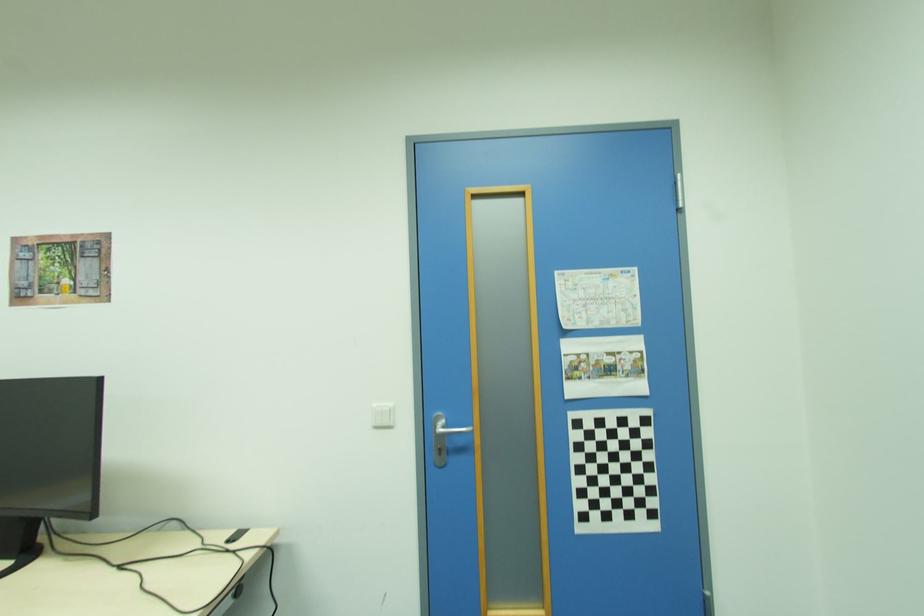
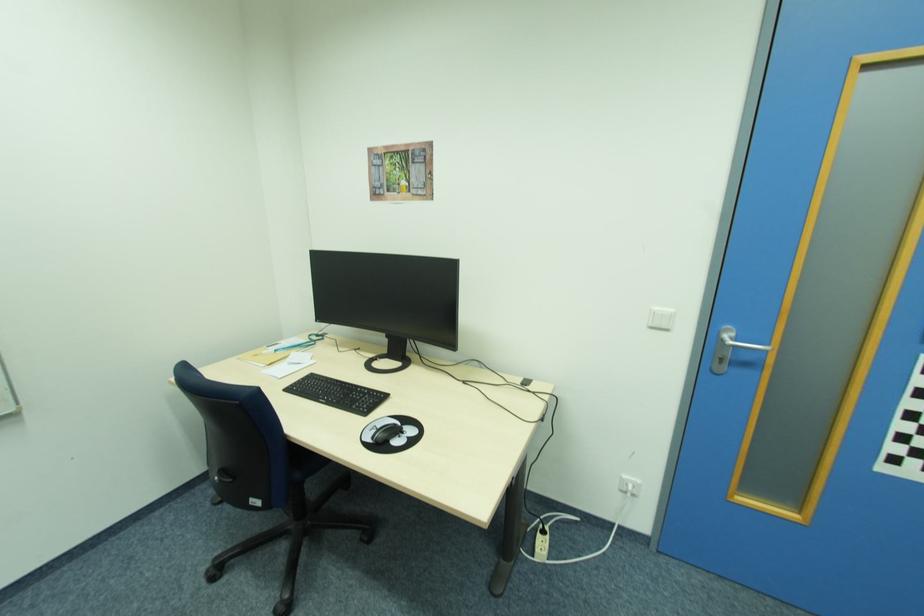
Locate, in the second image, the point that corresponds to (473,431) in the first image.

(768, 350)